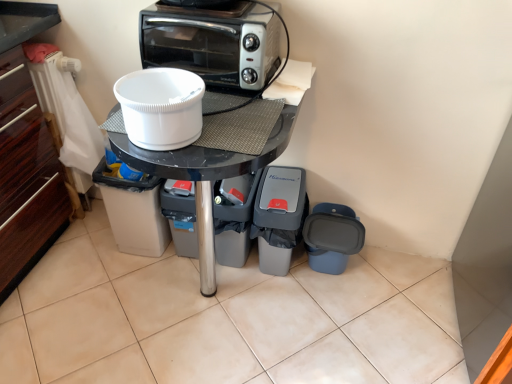
Where is `vacant area on top of black glossy table at center (from a real-world perspective)`? The width and height of the screenshot is (512, 384). vacant area on top of black glossy table at center (from a real-world perspective) is located at coordinates (223, 111).